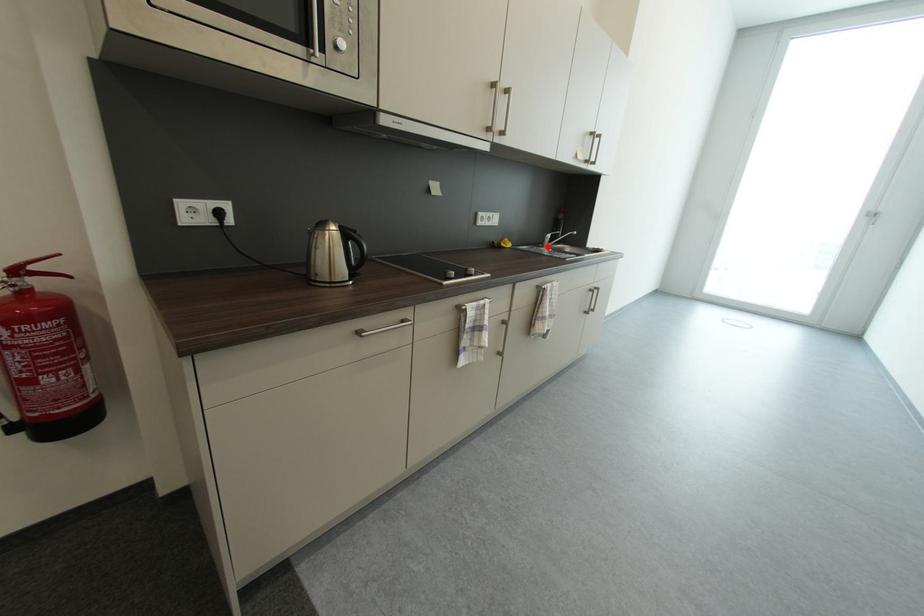
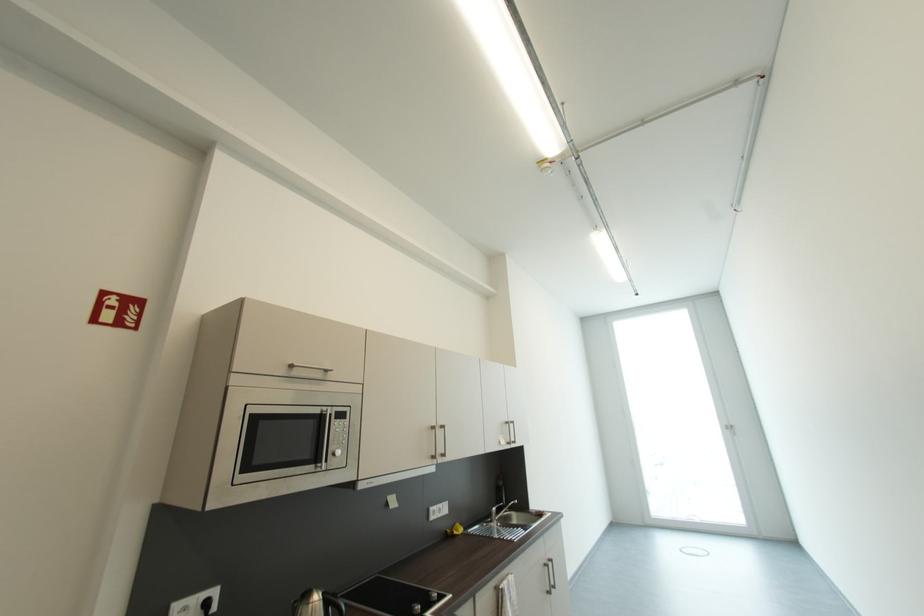
Locate, in the second image, the point that corresponds to the highlighted location in the first image.

(495, 522)